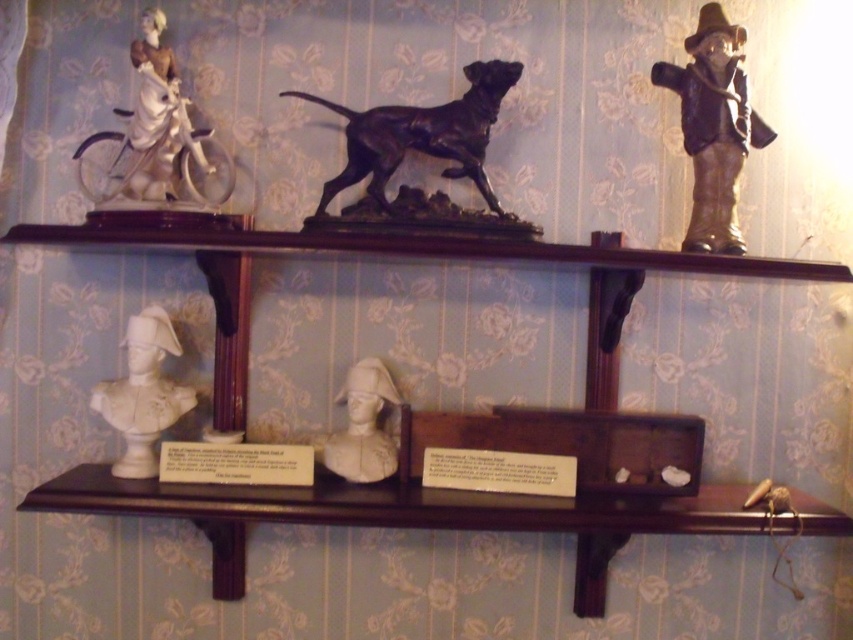
Does shiny black statue at center come behind white glossy bust at center?

No, it is in front of white glossy bust at center.

Which is more to the left, shiny black statue at center or white glossy bust at center?

white glossy bust at center

Is point (490, 86) positioned after point (132, 403)?

No, it is not.

Identify the location of shiny black statue at center. The width and height of the screenshot is (853, 640). (422, 134).

Which is above, shiny black statue at center or white porcelain figure at upper left?

white porcelain figure at upper left is higher up.

Can you confirm if shiny black statue at center is shorter than white porcelain figure at upper left?

Yes.

The height and width of the screenshot is (640, 853). What do you see at coordinates (422, 134) in the screenshot? I see `shiny black statue at center` at bounding box center [422, 134].

Identify the location of shiny black statue at center. The height and width of the screenshot is (640, 853). click(x=422, y=134).

Is bronze figurine at upper right closer to the viewer compared to white porcelain bust at center?

Yes, bronze figurine at upper right is closer to the viewer.

Does point (733, 118) lie in front of point (345, 445)?

Yes, it is.

Where is `bronze figurine at upper right`? This screenshot has width=853, height=640. bronze figurine at upper right is located at coordinates (714, 128).